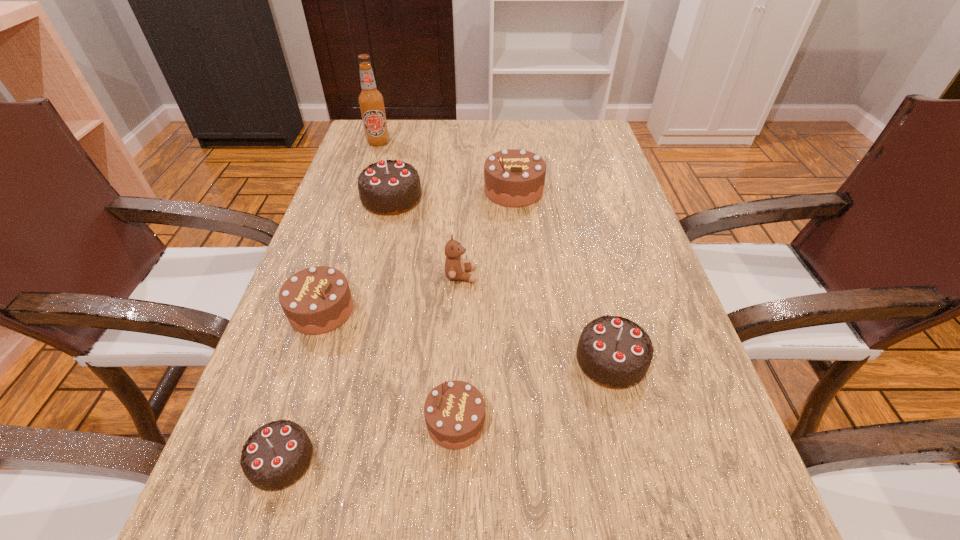
The height and width of the screenshot is (540, 960). Find the location of `chocolate cake that can be found as the second closest to the tallest object`. chocolate cake that can be found as the second closest to the tallest object is located at coordinates (513, 178).

Choose which chocolate cake is the second nearest neighbor to the third chocolate cake from right to left. Please provide its 2D coordinates. Your answer should be formatted as a tuple, i.e. [(x, y)], where the tuple contains the x and y coordinates of a point satisfying the conditions above.

[(278, 454)]

What are the coordinates of `brown chocolate cake that can be found as the second closest to the farthest chocolate chocolate cake` in the screenshot? It's located at (316, 300).

Locate an element on the screen. This screenshot has height=540, width=960. brown chocolate cake that is the nearest to the teddy bear is located at coordinates (316, 300).

Point out which chocolate chocolate cake is positioned as the third nearest to the biggest brown chocolate cake. Please provide its 2D coordinates. Your answer should be formatted as a tuple, i.e. [(x, y)], where the tuple contains the x and y coordinates of a point satisfying the conditions above.

[(278, 454)]

I want to click on chocolate chocolate cake that is the second nearest to the fourth chocolate cake from left to right, so click(x=278, y=454).

Locate an element on the screen. This screenshot has height=540, width=960. free region that satisfies the following two spatial constraints: 1. on the back side of the second object from right to left; 2. on the left side of the smallest chocolate chocolate cake is located at coordinates (367, 191).

Identify the location of free space that satisfies the following two spatial constraints: 1. on the front side of the second farthest brown chocolate cake; 2. on the left side of the smallest chocolate chocolate cake. The height and width of the screenshot is (540, 960). (272, 460).

This screenshot has width=960, height=540. I want to click on vacant space that satisfies the following two spatial constraints: 1. on the front side of the nearest chocolate chocolate cake; 2. on the right side of the second farthest brown chocolate cake, so click(272, 460).

Locate an element on the screen. free point that satisfies the following two spatial constraints: 1. on the back side of the biggest brown chocolate cake; 2. on the right side of the smallest chocolate chocolate cake is located at coordinates (367, 191).